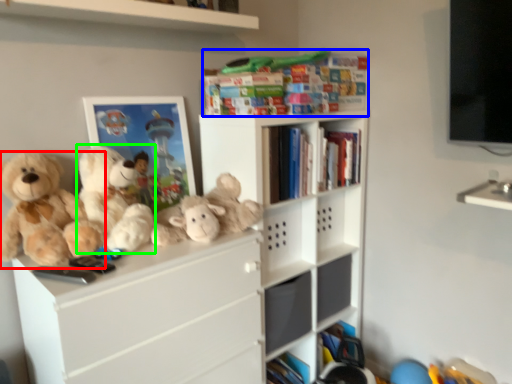
Question: Estimate the real-world distances between objects in this image. Which object is closer to teddy bear (highlighted by a red box), book (highlighted by a blue box) or teddy bear (highlighted by a green box)?

Choices:
 (A) book
 (B) teddy bear

Answer: (B)